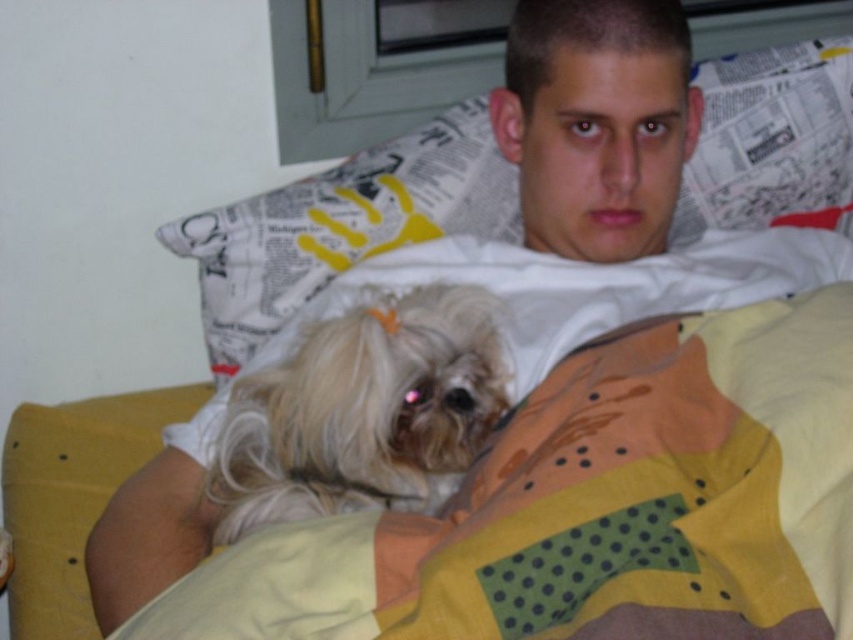
In the scene shown: Is white newspaper at upper center to the left of white fluffy dog at center from the viewer's perspective?

Correct, you'll find white newspaper at upper center to the left of white fluffy dog at center.

Can you confirm if white newspaper at upper center is positioned above white fluffy dog at center?

Yes.

Between point (291, 234) and point (395, 385), which one is positioned behind?

The point (291, 234) is behind.

The image size is (853, 640). In order to click on white newspaper at upper center in this screenshot , I will do `click(341, 225)`.

Between point (184, 595) and point (793, 58), which one is positioned in front?

Point (184, 595)

Which is above, yellow dotted fabric at lower center or white newspaper at upper center?

white newspaper at upper center is above.

Is point (526, 600) more distant than point (218, 317)?

No, it is in front of (218, 317).

Where is `yellow dotted fabric at lower center`? This screenshot has width=853, height=640. yellow dotted fabric at lower center is located at coordinates (595, 506).

This screenshot has width=853, height=640. Describe the element at coordinates (595, 506) in the screenshot. I see `yellow dotted fabric at lower center` at that location.

Who is shorter, yellow dotted fabric at lower center or white fluffy dog at center?

white fluffy dog at center

Who is more forward, (473,536) or (244,474)?

Point (473,536) is more forward.

You are a GUI agent. You are given a task and a screenshot of the screen. Output one action in this format:
    pyautogui.click(x=<x>, y=<y>)
    Task: Click on the yellow dotted fabric at lower center
    This screenshot has width=853, height=640.
    Given the screenshot: What is the action you would take?
    595,506